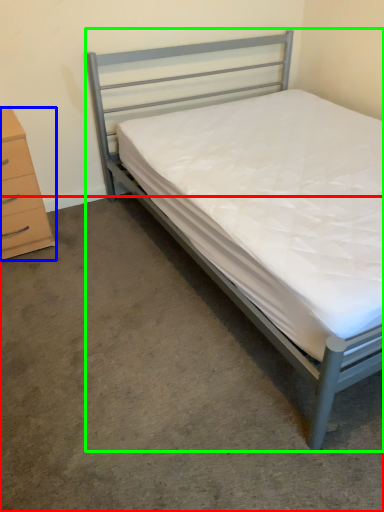
Question: Based on their relative distances, which object is nearer to concrete (highlighted by a red box)? Choose from chest of drawers (highlighted by a blue box) and bed (highlighted by a green box).

Choices:
 (A) chest of drawers
 (B) bed

Answer: (A)